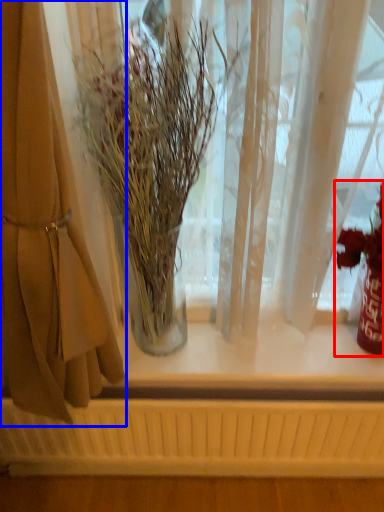
Question: Which object is further to the camera taking this photo, floral arrangement (highlighted by a red box) or curtain (highlighted by a blue box)?

Choices:
 (A) floral arrangement
 (B) curtain

Answer: (A)